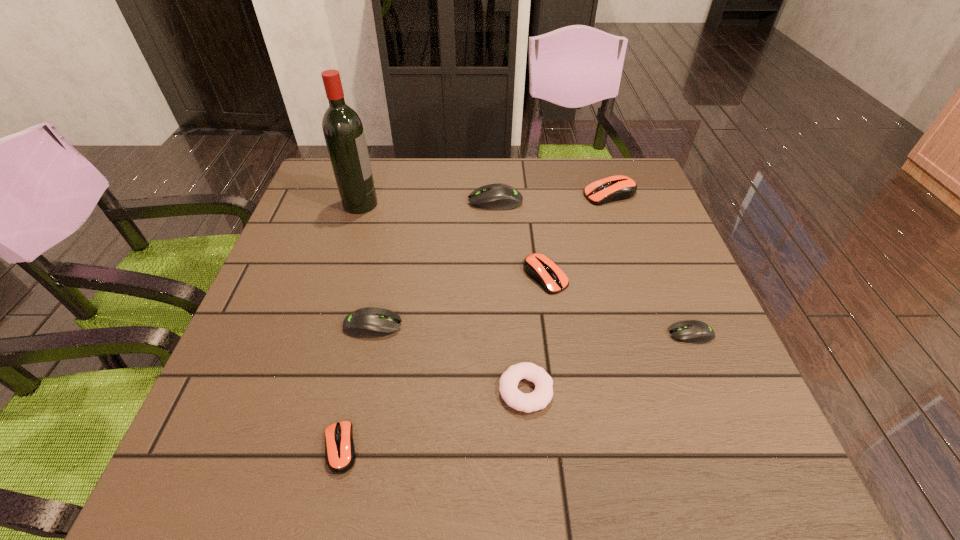
You are a GUI agent. You are given a task and a screenshot of the screen. Output one action in this format:
    pyautogui.click(x=<x>, y=<y>)
    Task: Click on the free space at the far edge of the desktop
    This screenshot has width=960, height=540.
    Given the screenshot: What is the action you would take?
    pyautogui.click(x=463, y=158)

Find the location of a particular element. The image size is (960, 540). free location at the left edge of the desktop is located at coordinates (328, 253).

In order to click on vacant position at the right edge of the desktop in this screenshot , I will do `click(665, 319)`.

Identify the location of blank space at the far left corner of the desktop. (327, 206).

Locate an element on the screen. The width and height of the screenshot is (960, 540). free space at the near left corner is located at coordinates (203, 455).

You are a GUI agent. You are given a task and a screenshot of the screen. Output one action in this format:
    pyautogui.click(x=<x>, y=<y>)
    Task: Click on the vacant area at the near right corner of the desktop
    The width and height of the screenshot is (960, 540).
    Given the screenshot: What is the action you would take?
    pyautogui.click(x=783, y=473)

Where is `vacant area that lies between the red wine bottle and the doughnut`? Image resolution: width=960 pixels, height=540 pixels. vacant area that lies between the red wine bottle and the doughnut is located at coordinates (444, 297).

Find the location of a particular element. free spot between the rightmost gray computer mouse and the farthest orange computer mouse is located at coordinates (651, 264).

At what (x,y) coordinates should I click in order to perform the action: click on blank region between the doughnut and the smallest gray computer mouse. Please return your answer as a coordinate pair (x, y). This screenshot has height=540, width=960. Looking at the image, I should click on (609, 362).

The width and height of the screenshot is (960, 540). I want to click on vacant area between the biggest gray computer mouse and the rightmost orange computer mouse, so coord(553,198).